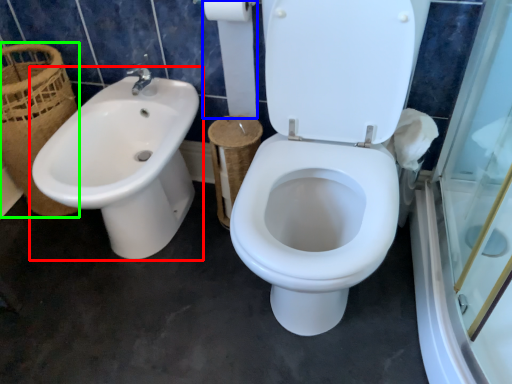
Question: Which object is positioned farthest from sink (highlighted by a red box)? Select from toilet paper (highlighted by a blue box) and basket (highlighted by a green box).

Choices:
 (A) toilet paper
 (B) basket

Answer: (A)